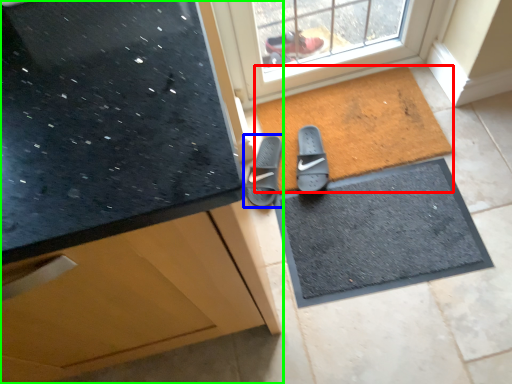
Question: Considering the real-world distances, which object is farthest from mat (highlighted by a red box)? footwear (highlighted by a blue box) or cabinetry (highlighted by a green box)?

Choices:
 (A) footwear
 (B) cabinetry

Answer: (B)